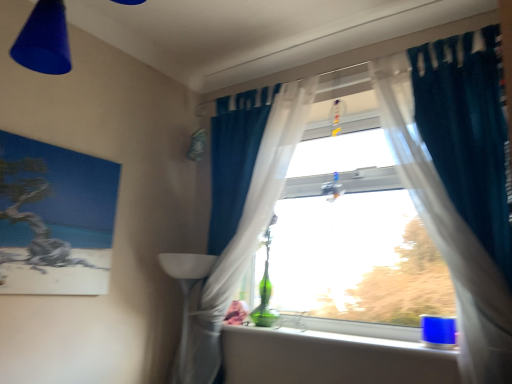
Question: Is blue plastic cup at lower right next to matte canvas painting at left?

Choices:
 (A) no
 (B) yes

Answer: (A)

Question: Can you confirm if blue plastic cup at lower right is positioned to the left of matte canvas painting at left?

Choices:
 (A) no
 (B) yes

Answer: (A)

Question: From the image's perspective, is blue plastic cup at lower right on matte canvas painting at left?

Choices:
 (A) yes
 (B) no

Answer: (B)

Question: From a real-world perspective, is blue plastic cup at lower right below matte canvas painting at left?

Choices:
 (A) no
 (B) yes

Answer: (B)

Question: Is blue plastic cup at lower right wider than matte canvas painting at left?

Choices:
 (A) no
 (B) yes

Answer: (B)

Question: Does blue plastic cup at lower right lie behind matte canvas painting at left?

Choices:
 (A) yes
 (B) no

Answer: (A)

Question: From the image's perspective, does blue plastic cup at lower right appear lower than translucent fabric curtain at center, the second curtain from the right?

Choices:
 (A) yes
 (B) no

Answer: (A)

Question: From a real-world perspective, does blue plastic cup at lower right stand above translucent fabric curtain at center, the second curtain from the right?

Choices:
 (A) no
 (B) yes

Answer: (A)

Question: Does blue plastic cup at lower right have a greater width compared to translucent fabric curtain at center, the second curtain from the right?

Choices:
 (A) yes
 (B) no

Answer: (A)

Question: Does blue plastic cup at lower right lie behind translucent fabric curtain at center, the second curtain from the right?

Choices:
 (A) no
 (B) yes

Answer: (A)

Question: Is blue plastic cup at lower right to the right of translucent fabric curtain at center, the 1th curtain in the left-to-right sequence, from the viewer's perspective?

Choices:
 (A) no
 (B) yes

Answer: (B)

Question: Is blue plastic cup at lower right next to translucent fabric curtain at center, the second curtain from the right?

Choices:
 (A) yes
 (B) no

Answer: (B)

Question: Is matte canvas painting at left not close to teal fabric curtain at upper right, marked as the second curtain in a left-to-right arrangement?

Choices:
 (A) yes
 (B) no

Answer: (A)